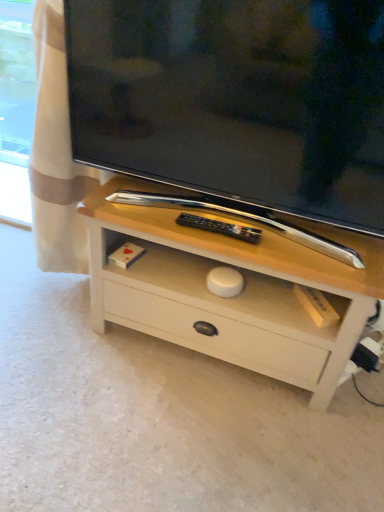
Question: Should I look upward or downward to see matte black tv at center?

Choices:
 (A) down
 (B) up

Answer: (B)

Question: Could you tell me if white painted wood chest of drawers at center is facing matte black tv at center?

Choices:
 (A) yes
 (B) no

Answer: (B)

Question: Is white painted wood chest of drawers at center directly adjacent to matte black tv at center?

Choices:
 (A) no
 (B) yes

Answer: (A)

Question: Considering the relative positions of white painted wood chest of drawers at center and matte black tv at center in the image provided, is white painted wood chest of drawers at center to the right of matte black tv at center from the viewer's perspective?

Choices:
 (A) yes
 (B) no

Answer: (A)

Question: From a real-world perspective, does white painted wood chest of drawers at center sit lower than matte black tv at center?

Choices:
 (A) no
 (B) yes

Answer: (B)

Question: Is white painted wood chest of drawers at center positioned far away from matte black tv at center?

Choices:
 (A) yes
 (B) no

Answer: (B)

Question: Would you say white painted wood chest of drawers at center is outside matte black tv at center?

Choices:
 (A) no
 (B) yes

Answer: (B)

Question: Is matte black tv at center positioned far away from white painted wood chest of drawers at center?

Choices:
 (A) no
 (B) yes

Answer: (A)

Question: Considering the relative sizes of matte black tv at center and white painted wood chest of drawers at center in the image provided, is matte black tv at center smaller than white painted wood chest of drawers at center?

Choices:
 (A) yes
 (B) no

Answer: (A)

Question: Is matte black tv at center outside white painted wood chest of drawers at center?

Choices:
 (A) no
 (B) yes

Answer: (B)

Question: Considering the relative sizes of matte black tv at center and white painted wood chest of drawers at center in the image provided, is matte black tv at center bigger than white painted wood chest of drawers at center?

Choices:
 (A) no
 (B) yes

Answer: (A)

Question: From the image's perspective, is matte black tv at center on top of white painted wood chest of drawers at center?

Choices:
 (A) no
 (B) yes

Answer: (B)

Question: Is matte black tv at center closer to camera compared to white painted wood chest of drawers at center?

Choices:
 (A) yes
 (B) no

Answer: (A)

Question: Considering the positions of matte black tv at center and white painted wood chest of drawers at center in the image, is matte black tv at center taller or shorter than white painted wood chest of drawers at center?

Choices:
 (A) short
 (B) tall

Answer: (B)